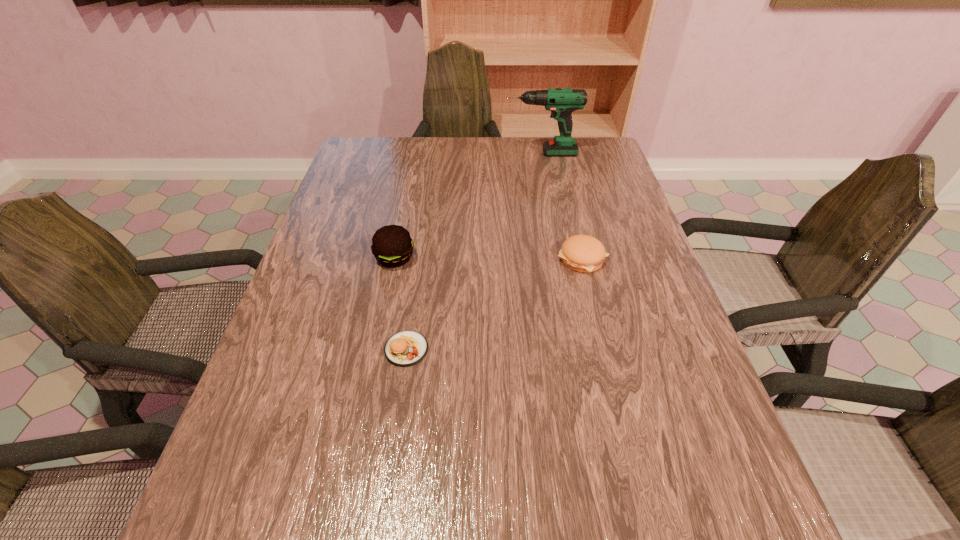
The image size is (960, 540). I want to click on free spot between the rightmost patty and the nearest object, so click(x=494, y=304).

You are a GUI agent. You are given a task and a screenshot of the screen. Output one action in this format:
    pyautogui.click(x=<x>, y=<y>)
    Task: Click on the empty space between the shortest object and the farthest object
    This screenshot has height=540, width=960.
    Given the screenshot: What is the action you would take?
    pyautogui.click(x=473, y=251)

Locate an element on the screen. vacant area that lies between the rightmost patty and the drill is located at coordinates (562, 206).

The width and height of the screenshot is (960, 540). Find the location of `object that is the third closest to the tallest patty`. object that is the third closest to the tallest patty is located at coordinates (561, 102).

Where is `object that is the second nearest to the rightmost patty`? This screenshot has height=540, width=960. object that is the second nearest to the rightmost patty is located at coordinates (392, 246).

You are a GUI agent. You are given a task and a screenshot of the screen. Output one action in this format:
    pyautogui.click(x=<x>, y=<y>)
    Task: Click on the closest patty to the nearest patty
    The height and width of the screenshot is (540, 960).
    Given the screenshot: What is the action you would take?
    pyautogui.click(x=392, y=246)

This screenshot has width=960, height=540. I want to click on the third closest patty to the farthest object, so click(x=406, y=348).

Locate an element on the screen. free space that satisfies the following two spatial constraints: 1. on the handle side of the farthest object; 2. on the back side of the rightmost patty is located at coordinates (560, 259).

The height and width of the screenshot is (540, 960). I want to click on free space in the image that satisfies the following two spatial constraints: 1. on the front side of the third shortest object; 2. on the left side of the rightmost patty, so coord(395,259).

Where is `free space in the image that satisfies the following two spatial constraints: 1. on the handle side of the tallest object; 2. on the left side of the rightmost patty`? This screenshot has height=540, width=960. free space in the image that satisfies the following two spatial constraints: 1. on the handle side of the tallest object; 2. on the left side of the rightmost patty is located at coordinates [560, 259].